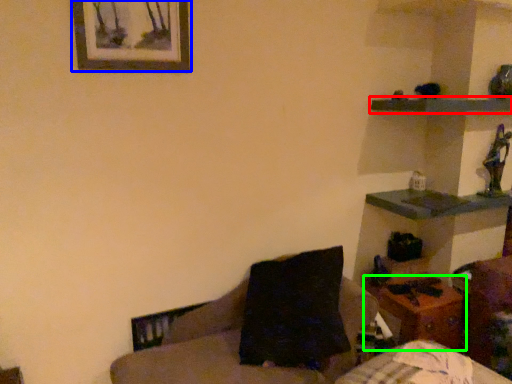
Question: Which is nearer to the shelf (highlighted by a red box)? picture frame (highlighted by a blue box) or table (highlighted by a green box).

Choices:
 (A) picture frame
 (B) table

Answer: (B)